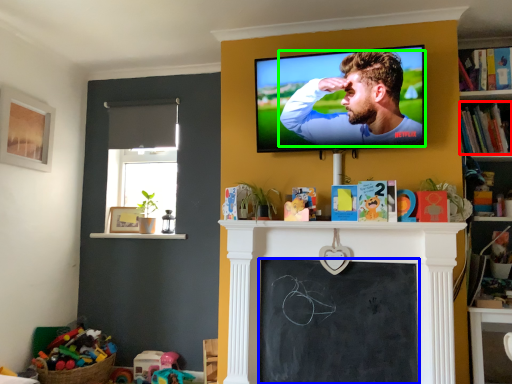
Question: Based on their relative distances, which object is farther from book (highlighted by a red box)? Choose from bulletin board (highlighted by a blue box) and man (highlighted by a green box).

Choices:
 (A) bulletin board
 (B) man

Answer: (A)